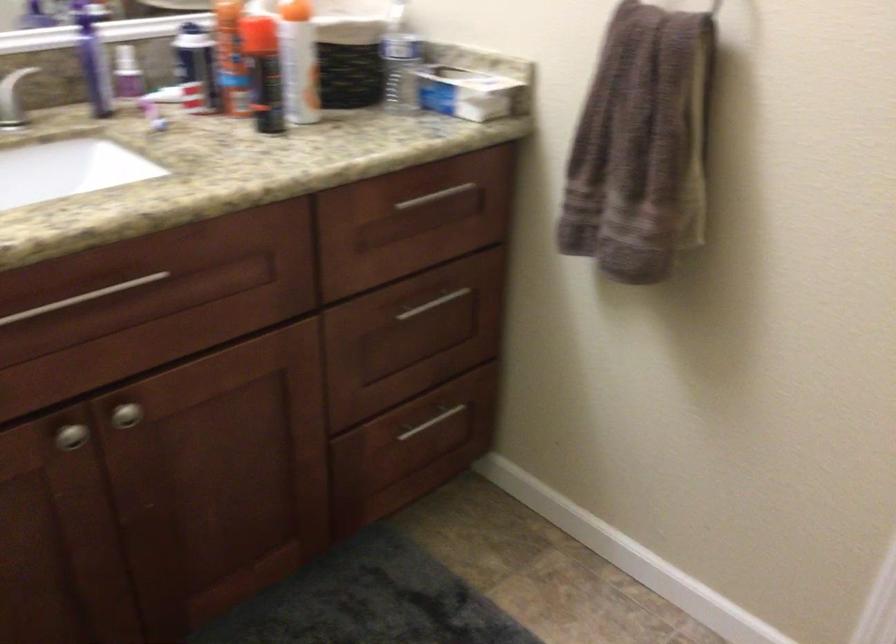
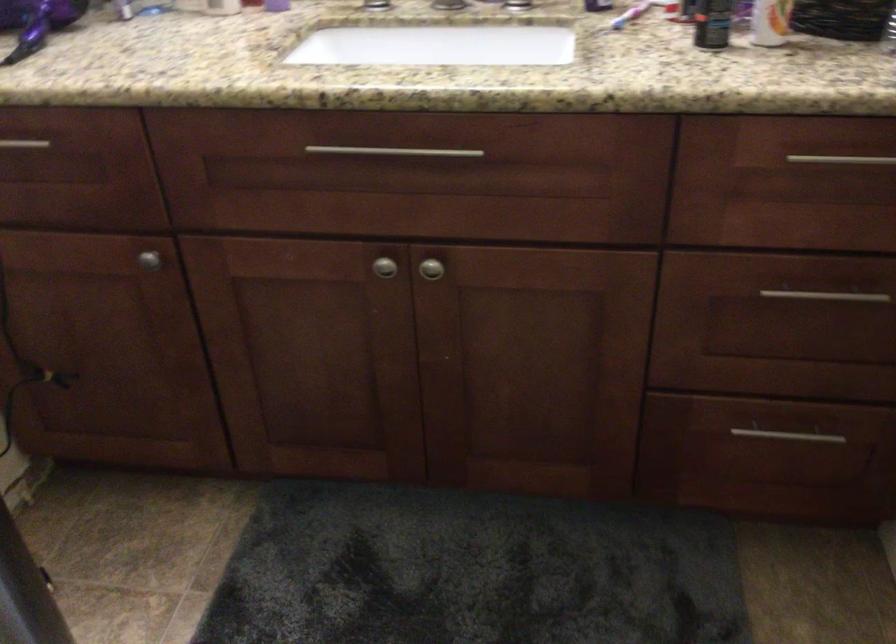
Find the pixel in the second image that matches (425,317) in the first image.

(815, 310)